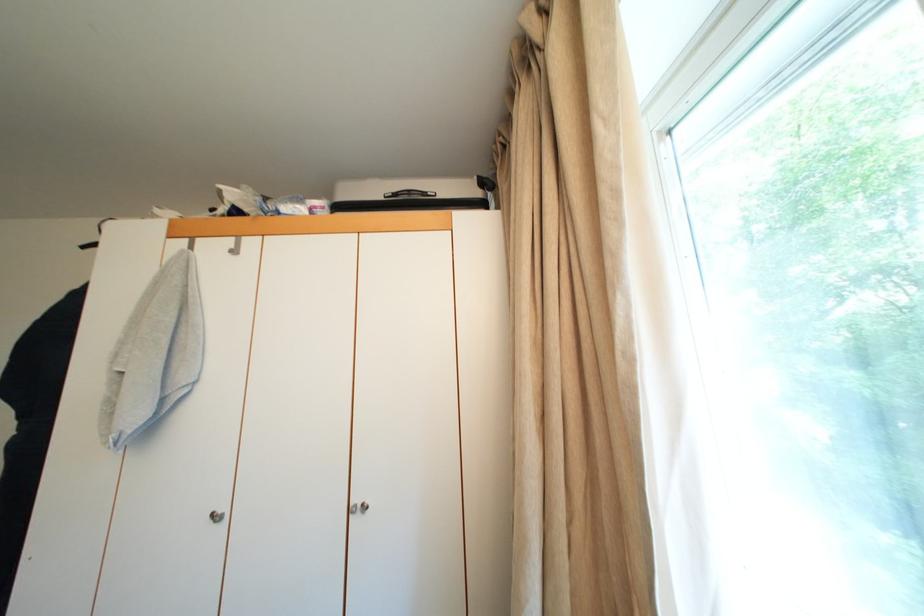
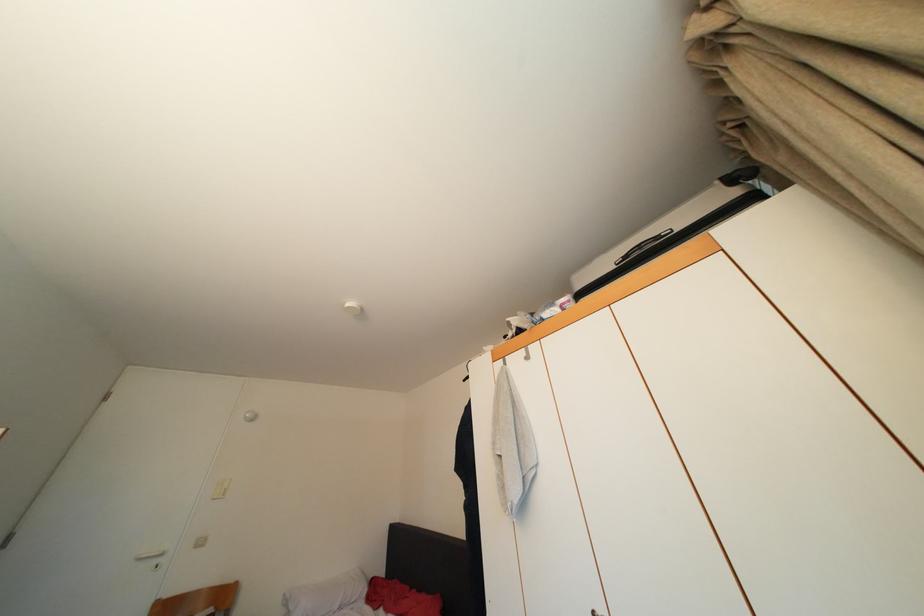
Based on the continuous images, in which direction is the camera rotating?

The rotation direction of the camera is left-up.